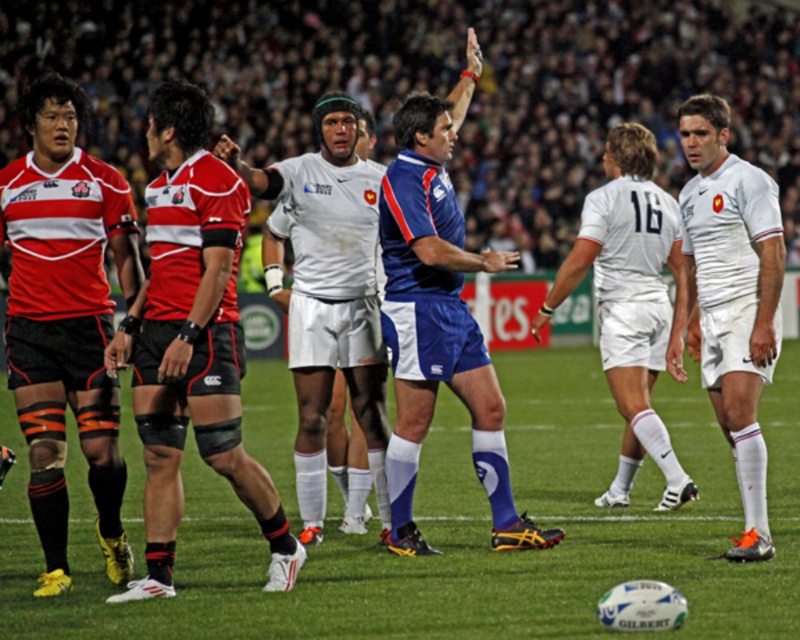
Question: Where is white matte shorts at center located in relation to white smooth shorts at center in the image?

Choices:
 (A) below
 (B) above

Answer: (A)

Question: Is matte red jersey at left behind white smooth jersey at center?

Choices:
 (A) yes
 (B) no

Answer: (B)

Question: Considering the real-world distances, which object is farthest from the matte red rugby jersey at left?

Choices:
 (A) white matte shorts at center
 (B) white smooth jersey at center

Answer: (B)

Question: Is matte red jersey at left thinner than blue synthetic referee at center?

Choices:
 (A) yes
 (B) no

Answer: (A)

Question: Which point is farther to the camera?

Choices:
 (A) (318, 444)
 (B) (612, 211)

Answer: (B)

Question: Among these points, which one is nearest to the camera?

Choices:
 (A) (521, 502)
 (B) (322, 464)

Answer: (B)